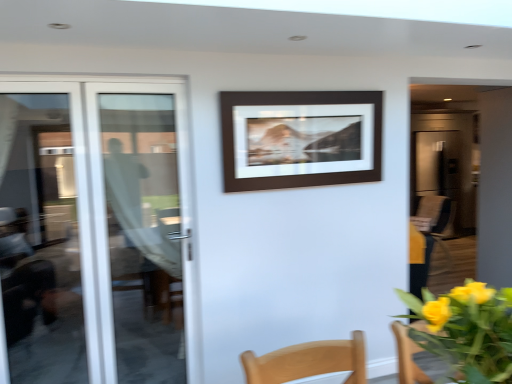
The image size is (512, 384). I want to click on yellow matte flowers at lower right, so click(x=467, y=330).

Looking at this image, is transparent glass door at left, which is the first door from right to left, not close to metallic silver refrigerator at right?

Absolutely, transparent glass door at left, which is the first door from right to left, is distant from metallic silver refrigerator at right.

Considering their positions, is transparent glass door at left, arranged as the 2th door when viewed from the left, located in front of or behind metallic silver refrigerator at right?

transparent glass door at left, arranged as the 2th door when viewed from the left, is positioned closer to the viewer than metallic silver refrigerator at right.

Which is correct: transparent glass door at left, which is the first door from right to left, is inside metallic silver refrigerator at right, or outside of it?

transparent glass door at left, which is the first door from right to left, is not enclosed by metallic silver refrigerator at right.

In the scene shown: Between transparent glass door at left, arranged as the 2th door when viewed from the left, and metallic silver refrigerator at right, which one has smaller size?

transparent glass door at left, arranged as the 2th door when viewed from the left.

Considering the relative positions of metallic silver refrigerator at right and yellow matte flowers at lower right in the image provided, is metallic silver refrigerator at right to the left of yellow matte flowers at lower right from the viewer's perspective?

No, metallic silver refrigerator at right is not to the left of yellow matte flowers at lower right.

From the image's perspective, relative to yellow matte flowers at lower right, is metallic silver refrigerator at right above or below?

Clearly, from the image's perspective, metallic silver refrigerator at right is above yellow matte flowers at lower right.

Is metallic silver refrigerator at right oriented towards yellow matte flowers at lower right?

No, metallic silver refrigerator at right is not turned towards yellow matte flowers at lower right.

Is the depth of transparent glass door at left, which is the first door from right to left, greater than that of brown matte picture frame at center?

No, transparent glass door at left, which is the first door from right to left, is closer to the camera.

The image size is (512, 384). I want to click on door that is the 2nd one below the brown matte picture frame at center (from a real-world perspective), so click(x=144, y=234).

Considering the relative sizes of transparent glass door at left, arranged as the 2th door when viewed from the left, and brown matte picture frame at center in the image provided, is transparent glass door at left, arranged as the 2th door when viewed from the left, taller than brown matte picture frame at center?

Correct, transparent glass door at left, arranged as the 2th door when viewed from the left, is much taller as brown matte picture frame at center.

Considering the relative sizes of transparent glass door at left, arranged as the 2th door when viewed from the left, and brown matte picture frame at center in the image provided, is transparent glass door at left, arranged as the 2th door when viewed from the left, smaller than brown matte picture frame at center?

Incorrect, transparent glass door at left, arranged as the 2th door when viewed from the left, is not smaller in size than brown matte picture frame at center.

Between white glass door at left, acting as the first door starting from the left, and yellow matte flowers at lower right, which one has smaller width?

Thinner between the two is white glass door at left, acting as the first door starting from the left.

Is white glass door at left, positioned as the 2th door in right-to-left order, to the right of yellow matte flowers at lower right from the viewer's perspective?

In fact, white glass door at left, positioned as the 2th door in right-to-left order, is to the left of yellow matte flowers at lower right.

Is white glass door at left, acting as the first door starting from the left, bigger than yellow matte flowers at lower right?

Yes, white glass door at left, acting as the first door starting from the left, is bigger than yellow matte flowers at lower right.

Image resolution: width=512 pixels, height=384 pixels. In order to click on door that is the 2nd object to the left of the brown matte picture frame at center, starting at the anchor in this screenshot , I will do `click(92, 229)`.

Considering the positions of points (169, 164) and (257, 109), is point (169, 164) closer to camera compared to point (257, 109)?

That is False.

Is white glass door at left, acting as the first door starting from the left, positioned beyond the bounds of brown matte picture frame at center?

Yes, white glass door at left, acting as the first door starting from the left, is located beyond the bounds of brown matte picture frame at center.

Considering the relative positions of white glass door at left, positioned as the 2th door in right-to-left order, and brown matte picture frame at center in the image provided, is white glass door at left, positioned as the 2th door in right-to-left order, to the right of brown matte picture frame at center from the viewer's perspective?

Incorrect, white glass door at left, positioned as the 2th door in right-to-left order, is not on the right side of brown matte picture frame at center.

Who is shorter, metallic silver refrigerator at right or brown matte picture frame at center?

Standing shorter between the two is brown matte picture frame at center.

Looking at the image, does metallic silver refrigerator at right seem bigger or smaller compared to brown matte picture frame at center?

Clearly, metallic silver refrigerator at right is larger in size than brown matte picture frame at center.

How different are the orientations of metallic silver refrigerator at right and brown matte picture frame at center in degrees?

The angular difference between metallic silver refrigerator at right and brown matte picture frame at center is 1.92 degrees.

Is metallic silver refrigerator at right facing away from brown matte picture frame at center?

No, metallic silver refrigerator at right is not facing away from brown matte picture frame at center.

In the scene shown: Which is less distant, (459, 226) or (184, 369)?

Point (459, 226) is positioned farther from the camera compared to point (184, 369).

Is there a large distance between metallic silver refrigerator at right and white glass door at left, positioned as the 2th door in right-to-left order?

Absolutely, metallic silver refrigerator at right is distant from white glass door at left, positioned as the 2th door in right-to-left order.

From the image's perspective, is metallic silver refrigerator at right located beneath white glass door at left, acting as the first door starting from the left?

Incorrect, from the image's perspective, metallic silver refrigerator at right is higher than white glass door at left, acting as the first door starting from the left.

From a real-world perspective, who is located lower, metallic silver refrigerator at right or white glass door at left, positioned as the 2th door in right-to-left order?

metallic silver refrigerator at right, from a real-world perspective.

Find the location of a particular element. The image size is (512, 384). screen door above the transparent glass door at left, arranged as the 2th door when viewed from the left (from the image's perspective) is located at coordinates (438, 170).

Where is `floral arrangement in front of the metallic silver refrigerator at right`? Image resolution: width=512 pixels, height=384 pixels. floral arrangement in front of the metallic silver refrigerator at right is located at coordinates (467, 330).

When comparing their distances from metallic silver refrigerator at right, does brown matte picture frame at center or transparent glass door at left, which is the first door from right to left, seem further?

The object further to metallic silver refrigerator at right is transparent glass door at left, which is the first door from right to left.

Considering their positions, is brown matte picture frame at center positioned closer to white glass door at left, positioned as the 2th door in right-to-left order, than transparent glass door at left, which is the first door from right to left?

The object closer to white glass door at left, positioned as the 2th door in right-to-left order, is transparent glass door at left, which is the first door from right to left.

When comparing their distances from transparent glass door at left, arranged as the 2th door when viewed from the left, does metallic silver refrigerator at right or yellow matte flowers at lower right seem further?

metallic silver refrigerator at right is further to transparent glass door at left, arranged as the 2th door when viewed from the left.

Looking at the image, which one is located closer to metallic silver refrigerator at right, white glass door at left, positioned as the 2th door in right-to-left order, or yellow matte flowers at lower right?

Among the two, white glass door at left, positioned as the 2th door in right-to-left order, is located nearer to metallic silver refrigerator at right.

Based on their spatial positions, is brown matte picture frame at center or white glass door at left, positioned as the 2th door in right-to-left order, closer to transparent glass door at left, arranged as the 2th door when viewed from the left?

Based on the image, white glass door at left, positioned as the 2th door in right-to-left order, appears to be nearer to transparent glass door at left, arranged as the 2th door when viewed from the left.

When comparing their distances from white glass door at left, positioned as the 2th door in right-to-left order, does metallic silver refrigerator at right or yellow matte flowers at lower right seem further?

metallic silver refrigerator at right is positioned further to the anchor white glass door at left, positioned as the 2th door in right-to-left order.

Which object lies nearer to the anchor point transparent glass door at left, arranged as the 2th door when viewed from the left, white glass door at left, acting as the first door starting from the left, or metallic silver refrigerator at right?

A: Among the two, white glass door at left, acting as the first door starting from the left, is located nearer to transparent glass door at left, arranged as the 2th door when viewed from the left.

Estimate the real-world distances between objects in this image. Which object is further from transparent glass door at left, which is the first door from right to left, brown matte picture frame at center or yellow matte flowers at lower right?

Among the two, yellow matte flowers at lower right is located further to transparent glass door at left, which is the first door from right to left.

Identify the location of door positioned between yellow matte flowers at lower right and transparent glass door at left, which is the first door from right to left, from near to far. (92, 229).

What are the coordinates of `door between white glass door at left, acting as the first door starting from the left, and metallic silver refrigerator at right in the front-back direction` in the screenshot? It's located at (144, 234).

Locate an element on the screen. The image size is (512, 384). picture frame between transparent glass door at left, which is the first door from right to left, and metallic silver refrigerator at right, along the z-axis is located at coordinates (300, 139).

At what (x,y) coordinates should I click in order to perform the action: click on door between white glass door at left, acting as the first door starting from the left, and brown matte picture frame at center. Please return your answer as a coordinate pair (x, y). This screenshot has width=512, height=384. Looking at the image, I should click on (144, 234).